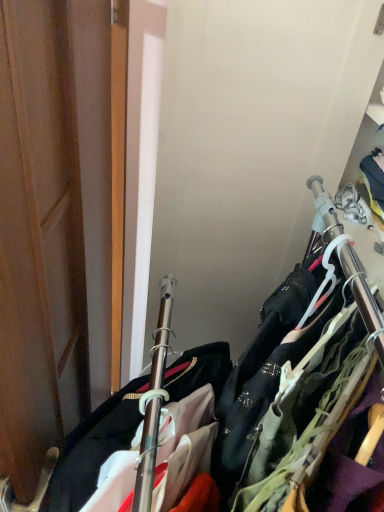
Question: Can you confirm if metallic hangers at center is wider than wooden door at left?

Choices:
 (A) yes
 (B) no

Answer: (A)

Question: Considering the relative sizes of metallic hangers at center and wooden door at left in the image provided, is metallic hangers at center taller than wooden door at left?

Choices:
 (A) no
 (B) yes

Answer: (B)

Question: From the image's perspective, is metallic hangers at center beneath wooden door at left?

Choices:
 (A) no
 (B) yes

Answer: (B)

Question: Is metallic hangers at center further to camera compared to wooden door at left?

Choices:
 (A) yes
 (B) no

Answer: (A)

Question: Would you say metallic hangers at center contains wooden door at left?

Choices:
 (A) yes
 (B) no

Answer: (B)

Question: Is metallic hangers at center oriented towards wooden door at left?

Choices:
 (A) yes
 (B) no

Answer: (A)

Question: Is wooden door at left shorter than metallic hangers at center?

Choices:
 (A) yes
 (B) no

Answer: (A)

Question: Is wooden door at left taller than metallic hangers at center?

Choices:
 (A) no
 (B) yes

Answer: (A)

Question: Is the depth of wooden door at left less than that of metallic hangers at center?

Choices:
 (A) yes
 (B) no

Answer: (A)

Question: Can you confirm if wooden door at left is thinner than metallic hangers at center?

Choices:
 (A) yes
 (B) no

Answer: (A)

Question: Is wooden door at left at the left side of metallic hangers at center?

Choices:
 (A) yes
 (B) no

Answer: (A)

Question: Is wooden door at left further to the viewer compared to metallic hangers at center?

Choices:
 (A) yes
 (B) no

Answer: (B)

Question: Is wooden door at left bigger or smaller than metallic hangers at center?

Choices:
 (A) small
 (B) big

Answer: (A)